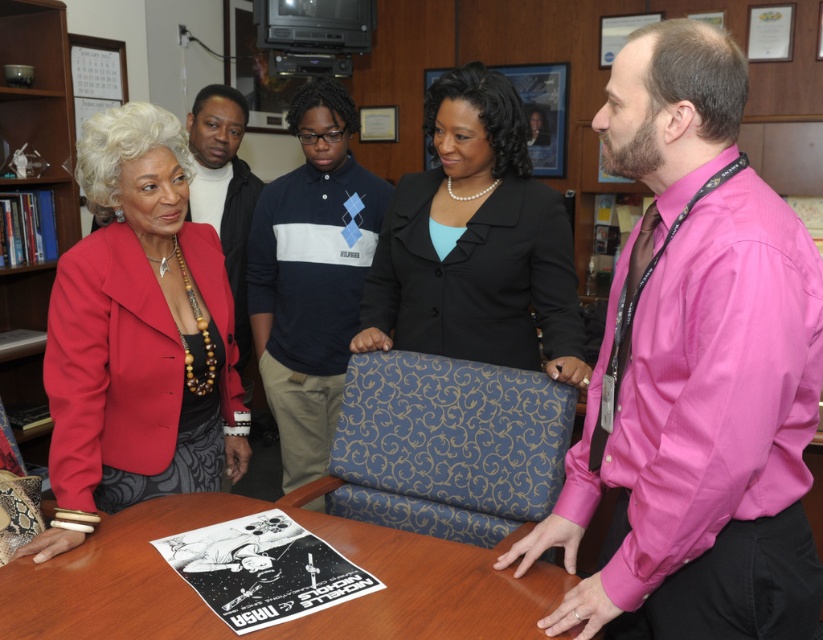
Question: Is matte red blazer at left thinner than wooden table at center?

Choices:
 (A) no
 (B) yes

Answer: (B)

Question: Which point is farther to the camera?

Choices:
 (A) (235, 129)
 (B) (521, 241)
 (C) (16, 180)

Answer: (A)

Question: Can you confirm if pink satin shirt at right is positioned to the right of matte red blazer at left?

Choices:
 (A) yes
 (B) no

Answer: (A)

Question: Estimate the real-world distances between objects in this image. Which object is closer to the wooden bookshelf at upper left?

Choices:
 (A) wooden table at center
 (B) matte red blazer at left
 (C) navy blue sweater at center

Answer: (C)

Question: Which point is closer to the camera?

Choices:
 (A) (295, 209)
 (B) (249, 348)

Answer: (A)

Question: Does pink satin shirt at right appear under black satin blazer at center?

Choices:
 (A) yes
 (B) no

Answer: (A)